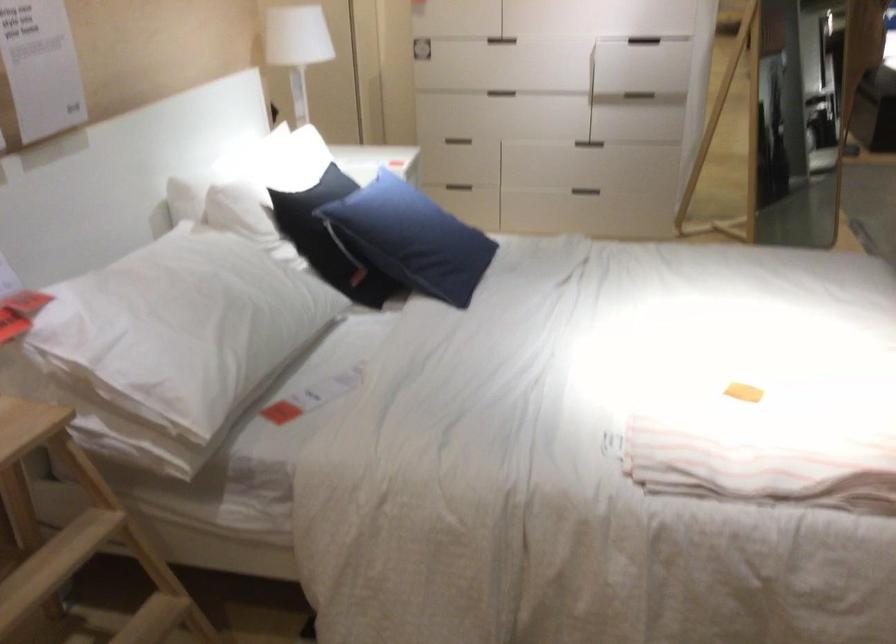
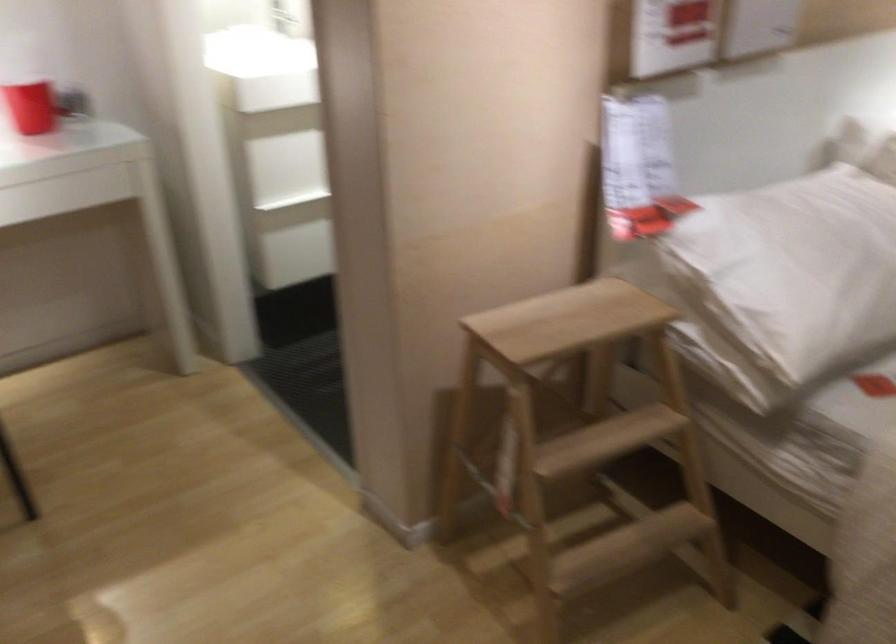
Locate, in the second image, the point that corresponds to (x=161, y=353) in the first image.

(785, 281)